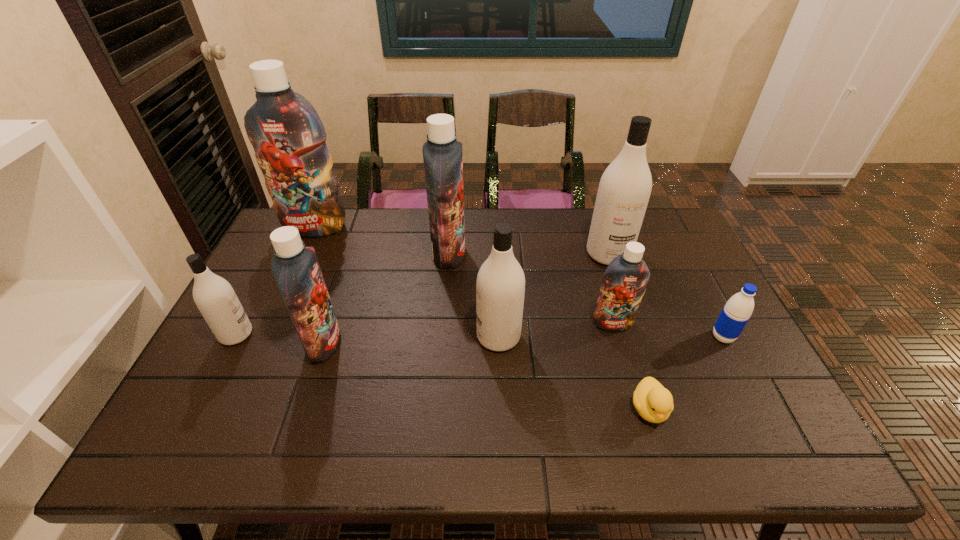
Locate an element on the screen. This screenshot has width=960, height=540. free location at the far edge of the desktop is located at coordinates (561, 214).

Locate an element on the screen. The height and width of the screenshot is (540, 960). free point at the near edge is located at coordinates (537, 446).

Find the location of a particular element. vacant space at the left edge of the desktop is located at coordinates (259, 296).

The height and width of the screenshot is (540, 960). I want to click on blank space at the far left corner, so click(x=312, y=245).

Where is `free spot between the rightmost blue shampoo and the second biggest white shampoo`? free spot between the rightmost blue shampoo and the second biggest white shampoo is located at coordinates (556, 330).

Where is `empty space that is in between the second shortest object and the third smallest blue shampoo`? empty space that is in between the second shortest object and the third smallest blue shampoo is located at coordinates pyautogui.click(x=586, y=295).

Identify the location of vacant space that's between the second smallest blue shampoo and the second blue shampoo from right to left. The image size is (960, 540). (387, 298).

The width and height of the screenshot is (960, 540). In order to click on free space between the biggest white shampoo and the rightmost object in this screenshot , I will do `click(665, 295)`.

Identify the location of empty space that is in between the rightmost blue shampoo and the biggest blue shampoo. (464, 275).

The width and height of the screenshot is (960, 540). What are the coordinates of `vacant point located between the smallest blue shampoo and the duck` in the screenshot? It's located at (631, 366).